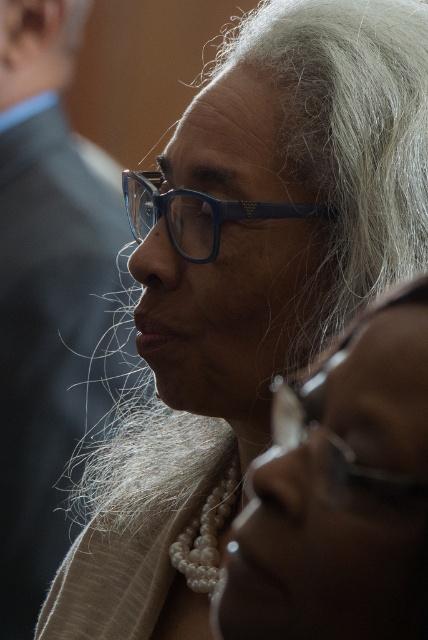
You are a photographer adjusting the camera settings to focus on both the pearl necklace at center and the blue plastic glasses at center. Which object will require a closer focus due to its smaller size?

The pearl necklace at center requires closer focus because its width is smaller than the blue plastic glasses at center.

You are a photographer adjusting your camera settings. You notice a point at coordinates point (338, 451) in the image. Based on the scene description, where is this point located?

The point (338, 451) is located on the metallic silver glasses at lower right.

You are a photographer adjusting the lighting for a portrait. You notice the pearl necklace at center and the blue plastic glasses at center. Which object is positioned to the right side of the other?

The pearl necklace at center is to the right of the blue plastic glasses at center.